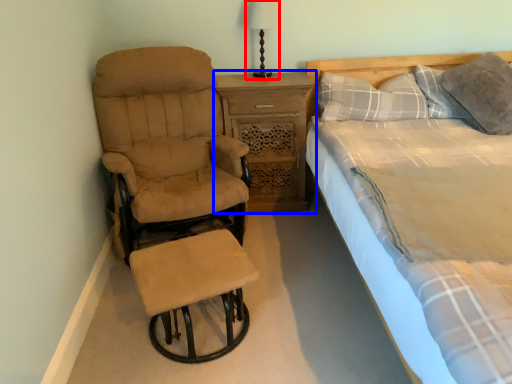
Question: Which of the following is the farthest to the observer, bedside lamp (highlighted by a red box) or nightstand (highlighted by a blue box)?

Choices:
 (A) bedside lamp
 (B) nightstand

Answer: (A)